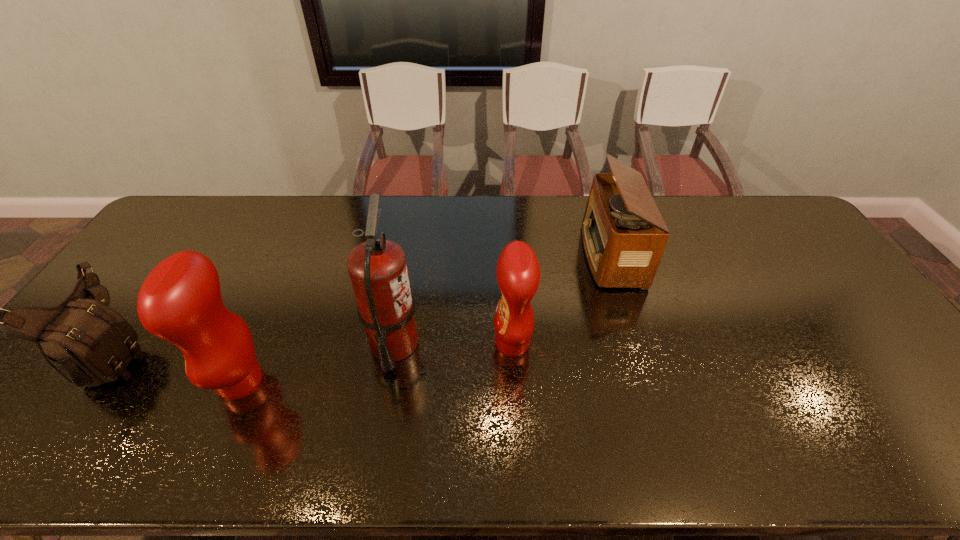
I want to click on free space that is in between the leftmost object and the taller condiment, so pyautogui.click(x=180, y=367).

Find the location of a particular element. The image size is (960, 540). vacant point located between the shorter condiment and the left condiment is located at coordinates (376, 362).

At what (x,y) coordinates should I click in order to perform the action: click on free space between the shoulder bag and the fire extinguisher. Please return your answer as a coordinate pair (x, y). This screenshot has height=540, width=960. Looking at the image, I should click on (256, 348).

I want to click on empty space that is in between the third object from right to left and the shoulder bag, so pos(256,348).

Find the location of a particular element. Image resolution: width=960 pixels, height=540 pixels. blank region between the leftmost object and the left condiment is located at coordinates (180, 367).

You are a GUI agent. You are given a task and a screenshot of the screen. Output one action in this format:
    pyautogui.click(x=<x>, y=<y>)
    Task: Click on the empty space between the leftmost object and the fire extinguisher
    This screenshot has width=960, height=540.
    Given the screenshot: What is the action you would take?
    pyautogui.click(x=256, y=348)

Locate which object ranks second in proximity to the third object from right to left. Please provide its 2D coordinates. Your answer should be formatted as a tuple, i.e. [(x, y)], where the tuple contains the x and y coordinates of a point satisfying the conditions above.

[(180, 301)]

Locate which object is the closest to the left condiment. Please provide its 2D coordinates. Your answer should be formatted as a tuple, i.e. [(x, y)], where the tuple contains the x and y coordinates of a point satisfying the conditions above.

[(87, 342)]